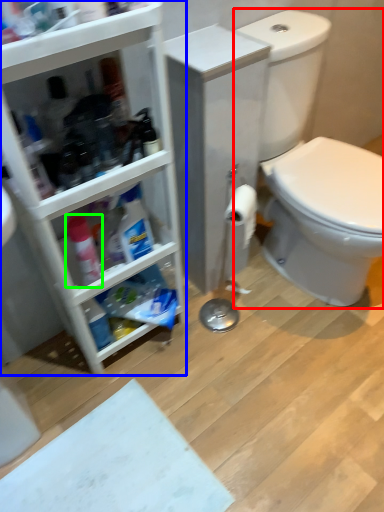
Question: Estimate the real-world distances between objects in this image. Which object is closer to sit (highlighted by a red box), bathroom cabinet (highlighted by a blue box) or cleaning product (highlighted by a green box)?

Choices:
 (A) bathroom cabinet
 (B) cleaning product

Answer: (A)